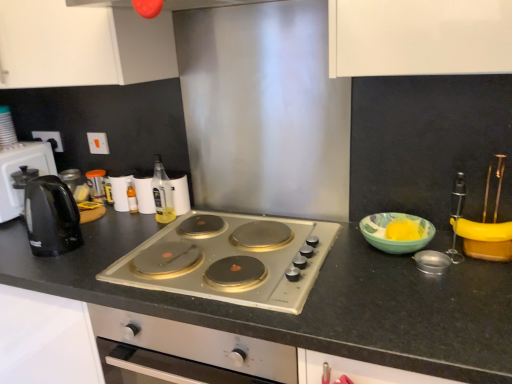
Question: Considering the positions of translucent glass bottle at center, which ranks as the 2th bottle in front-to-back order, and white matte cabinet at upper left in the image, is translucent glass bottle at center, which ranks as the 2th bottle in front-to-back order, wider or thinner than white matte cabinet at upper left?

Choices:
 (A) wide
 (B) thin

Answer: (B)

Question: Would you say translucent glass bottle at center, arranged as the 1th bottle when viewed from the back, is inside or outside white matte cabinet at upper left?

Choices:
 (A) inside
 (B) outside

Answer: (B)

Question: Which of these objects is positioned closest to the white matte cabinet at upper left?

Choices:
 (A) matte green bowl at right
 (B) silver metallic stove at center
 (C) black plastic kettle at left
 (D) translucent glass bottle at center, the second bottle when ordered from left to right
 (E) black granite countertop at center

Answer: (D)

Question: Estimate the real-world distances between objects in this image. Which object is farther from the translucent glass bottle at center, which ranks as the 2th bottle in front-to-back order?

Choices:
 (A) black granite countertop at center
 (B) matte green bowl at right
 (C) silver metallic stove at center
 (D) white matte cabinet at upper left
 (E) black plastic kettle at left

Answer: (B)